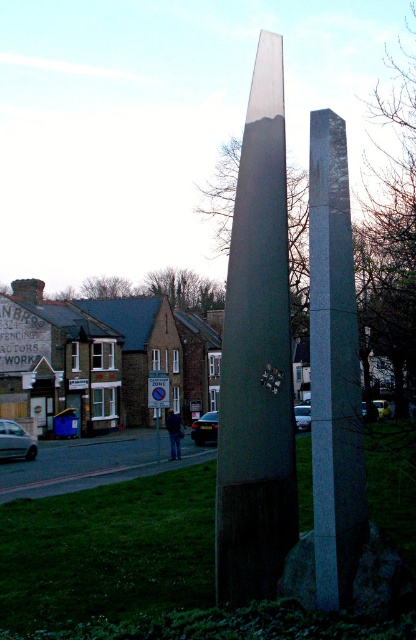
Which is in front, point (297, 506) or point (324, 390)?

Point (324, 390) is more forward.

Image resolution: width=416 pixels, height=640 pixels. What do you see at coordinates (257, 358) in the screenshot?
I see `metallic polished obelisk at center` at bounding box center [257, 358].

Locate an element on the screen. The width and height of the screenshot is (416, 640). metallic polished obelisk at center is located at coordinates (257, 358).